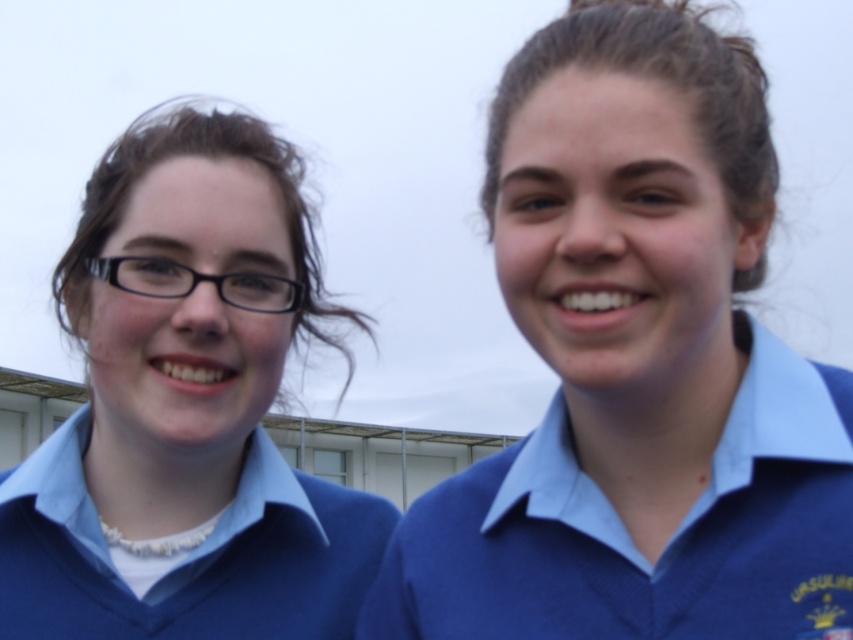
Question: Considering the relative positions of blue matte sweater at right and blue jersey at center in the image provided, where is blue matte sweater at right located with respect to blue jersey at center?

Choices:
 (A) above
 (B) below

Answer: (A)

Question: Which object is positioned closest to the blue matte sweater at right?

Choices:
 (A) matte blue sweater at left
 (B) blue jersey at center

Answer: (A)

Question: Is matte blue sweater at left further to camera compared to blue jersey at center?

Choices:
 (A) yes
 (B) no

Answer: (B)

Question: Which point is closer to the camera taking this photo?

Choices:
 (A) (4, 593)
 (B) (799, 440)

Answer: (B)

Question: Does blue matte sweater at right appear under matte blue sweater at left?

Choices:
 (A) yes
 (B) no

Answer: (B)

Question: Which point is farther to the camera?

Choices:
 (A) blue jersey at center
 (B) blue matte sweater at right

Answer: (A)